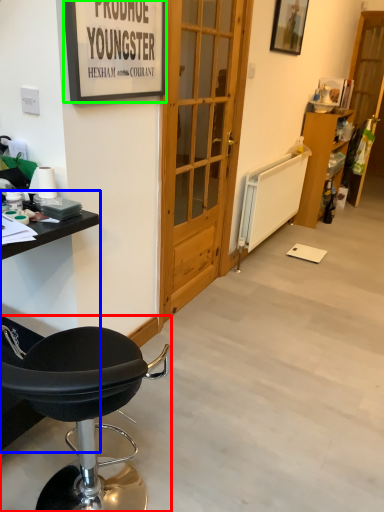
Question: Based on their relative distances, which object is farther from chair (highlighted by a red box)? Choose from table (highlighted by a blue box) and picture frame (highlighted by a green box).

Choices:
 (A) table
 (B) picture frame

Answer: (B)